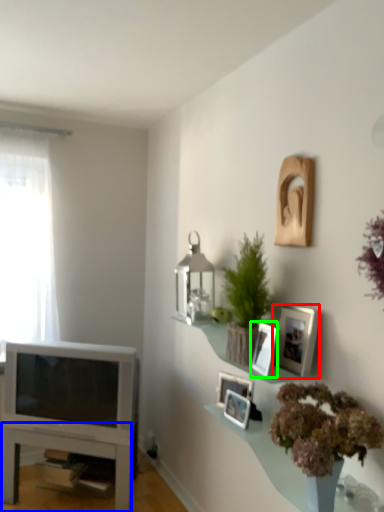
Question: Estimate the real-world distances between objects in this image. Which object is closer to picture frame (highlighted by a red box), table (highlighted by a blue box) or picture frame (highlighted by a green box)?

Choices:
 (A) table
 (B) picture frame

Answer: (B)